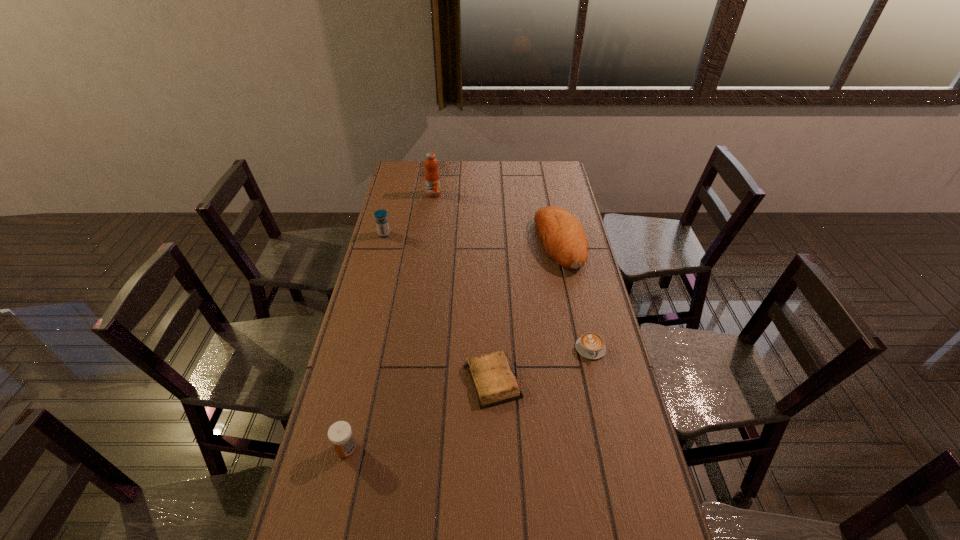
The width and height of the screenshot is (960, 540). In order to click on vacant space that is in between the cappuccino and the shorter medicine in this screenshot , I will do `click(468, 399)`.

Locate an element on the screen. the fourth closest object to the cappuccino is located at coordinates (382, 223).

Locate an element on the screen. The image size is (960, 540). the closest object to the bread is located at coordinates (590, 345).

Identify the location of free space that satisfies the following two spatial constraints: 1. on the back side of the bread; 2. on the left side of the shorter medicine. (394, 243).

The image size is (960, 540). In order to click on vacant area that satisfies the following two spatial constraints: 1. on the back side of the bread; 2. on the right side of the diary in this screenshot , I will do `click(490, 243)`.

The width and height of the screenshot is (960, 540). In order to click on free space that satisfies the following two spatial constraints: 1. on the front label of the bread; 2. on the left side of the fruit juice in this screenshot , I will do coord(427,243).

This screenshot has width=960, height=540. Find the location of `free spot that satisfies the following two spatial constraints: 1. on the front label of the bread; 2. on the right side of the fruit juice`. free spot that satisfies the following two spatial constraints: 1. on the front label of the bread; 2. on the right side of the fruit juice is located at coordinates (427, 243).